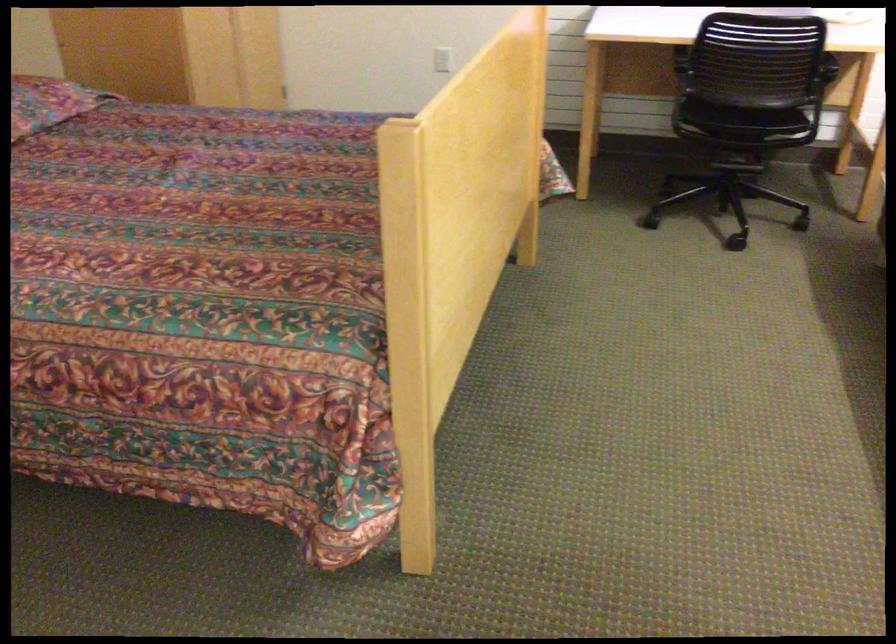
I want to click on chair sitting surface, so click(745, 122).